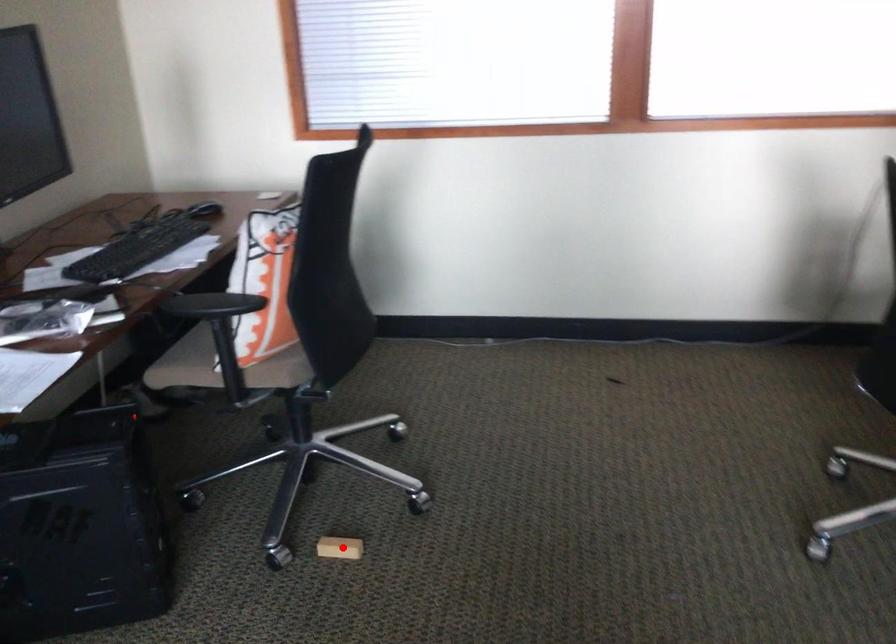
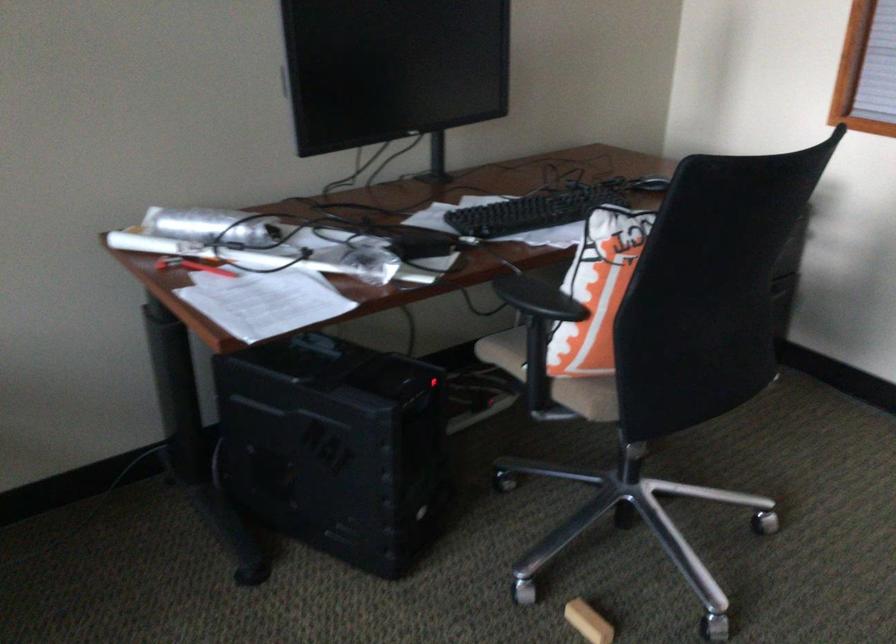
Question: I am providing you with two images of the same scene from different viewpoints. A red point is marked on the first image. At the location where the point appears in image 1, is it still visible in image 2?

Choices:
 (A) Yes
 (B) No

Answer: (A)